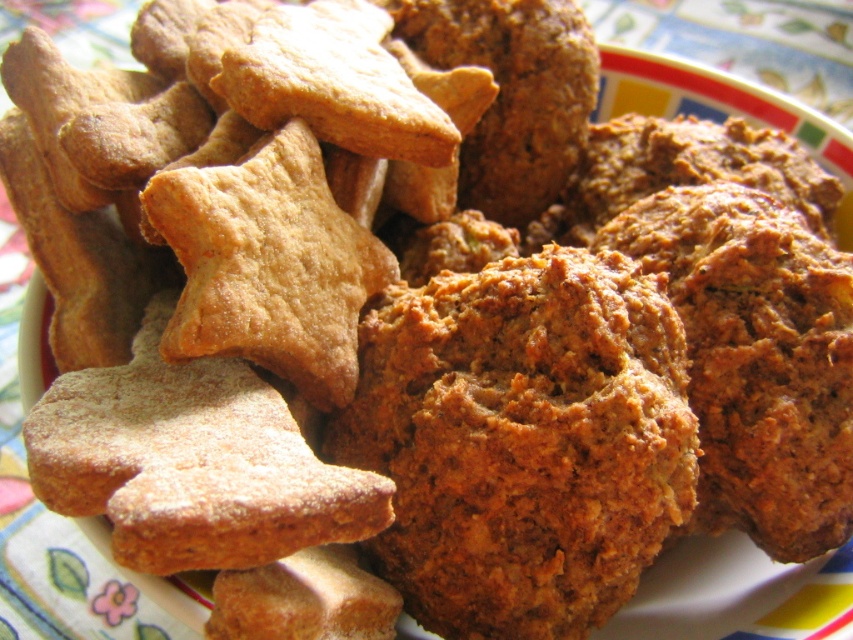
Identify the location of brown crumbly muffin at center. (521, 440).

Measure the distance between point (474, 547) and camera.

93.07 centimeters

Where is `brown crumbly muffin at center`? brown crumbly muffin at center is located at coordinates (521, 440).